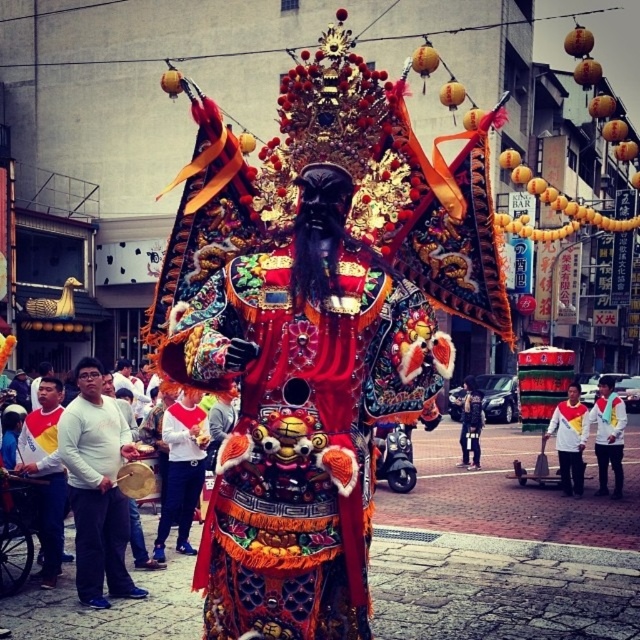
Question: Which point is farther to the camera?

Choices:
 (A) richly embroidered robe at center
 (B) dark blue fabric jacket at center
 (C) white matte drum at left
 (D) white fabric shirt at center

Answer: (B)

Question: Can you confirm if white matte drum at left is positioned above dark blue fabric jacket at center?

Choices:
 (A) no
 (B) yes

Answer: (B)

Question: Which object is positioned closest to the white jersey at center?

Choices:
 (A) richly embroidered robe at center
 (B) white matte drum at left
 (C) white fabric shirt at center

Answer: (C)

Question: Is richly embroidered robe at center to the left of white matte drum at left from the viewer's perspective?

Choices:
 (A) no
 (B) yes

Answer: (A)

Question: Among these points, which one is nearest to the camera?

Choices:
 (A) (573, 488)
 (B) (461, 403)
 (C) (90, 563)

Answer: (C)

Question: Does white matte drum at left appear on the right side of white fabric shirt at center?

Choices:
 (A) yes
 (B) no

Answer: (B)